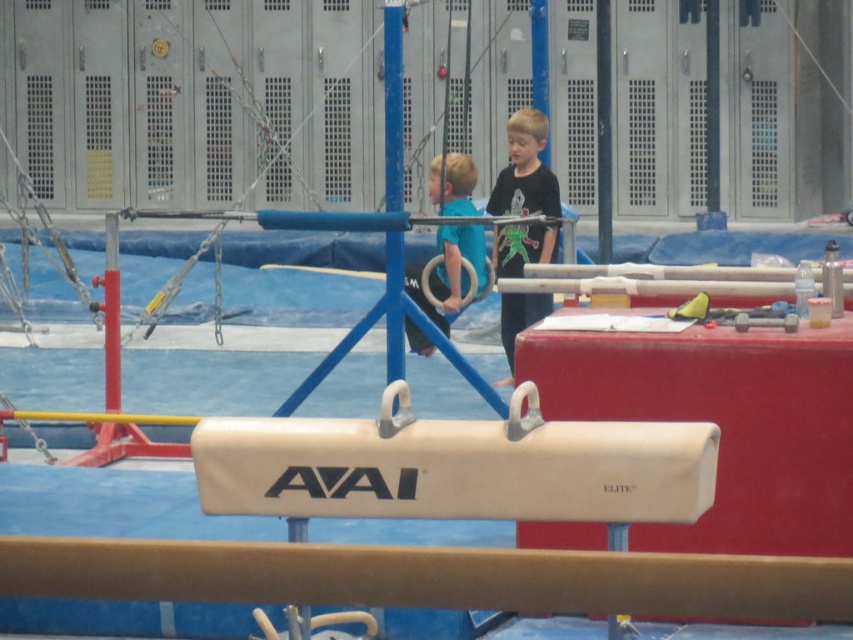
Who is positioned more to the left, beige rubber pommel horse at center or black matte shirt at center?

From the viewer's perspective, beige rubber pommel horse at center appears more on the left side.

Is point (641, 426) farther from camera compared to point (506, 230)?

That is False.

Locate an element on the screen. beige rubber pommel horse at center is located at coordinates (456, 467).

Can you confirm if smooth tan gymnastics beam at center is positioned to the right of black matte shirt at center?

Incorrect, smooth tan gymnastics beam at center is not on the right side of black matte shirt at center.

Looking at this image, does smooth tan gymnastics beam at center appear under black matte shirt at center?

Yes, smooth tan gymnastics beam at center is below black matte shirt at center.

What are the coordinates of `smooth tan gymnastics beam at center` in the screenshot? It's located at (431, 577).

Does black matte shirt at center appear on the right side of blue metallic pole at center?

Correct, you'll find black matte shirt at center to the right of blue metallic pole at center.

Who is shorter, black matte shirt at center or blue metallic pole at center?

With less height is black matte shirt at center.

Who is more forward, (515, 154) or (386, 253)?

Point (386, 253) is more forward.

Identify the location of black matte shirt at center. This screenshot has height=640, width=853. (525, 170).